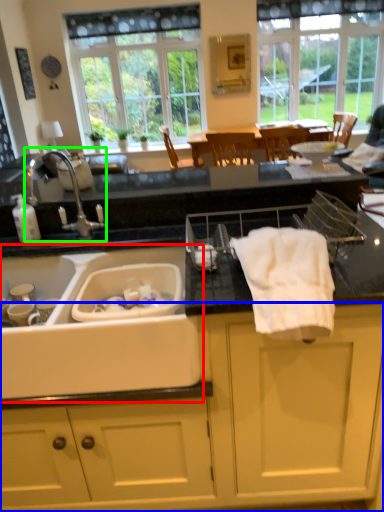
Question: Based on their relative distances, which object is farther from sink (highlighted by a red box)? Choose from cabinetry (highlighted by a blue box) and tap (highlighted by a green box).

Choices:
 (A) cabinetry
 (B) tap

Answer: (B)